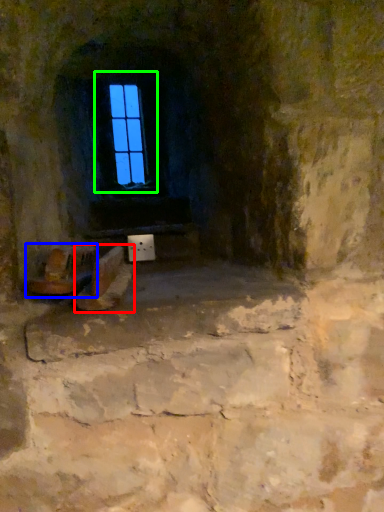
Question: Which is nearer to the footwear (highlighted by a red box)? chair (highlighted by a blue box) or window (highlighted by a green box).

Choices:
 (A) chair
 (B) window

Answer: (A)